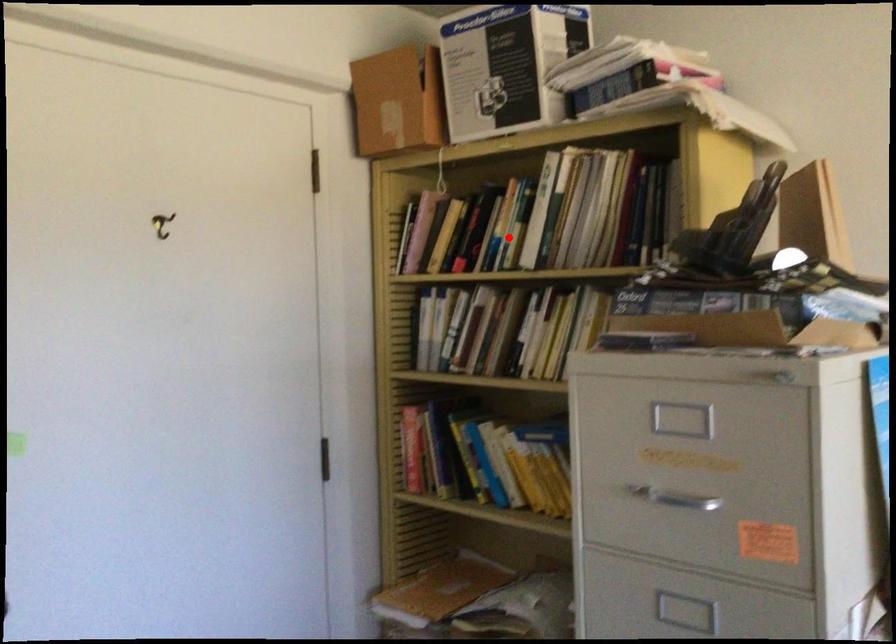
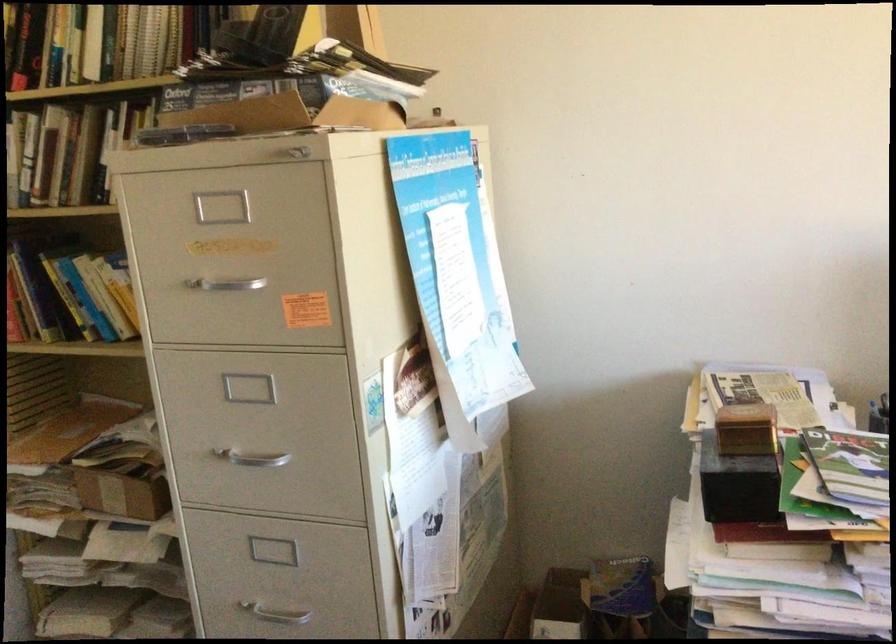
Question: A red point is marked in image1. In image2, is the corresponding 3D point closer to the camera or farther? Reply with the corresponding letter.

Choices:
 (A) The corresponding 3D point is closer.
 (B) The corresponding 3D point is farther.

Answer: (A)